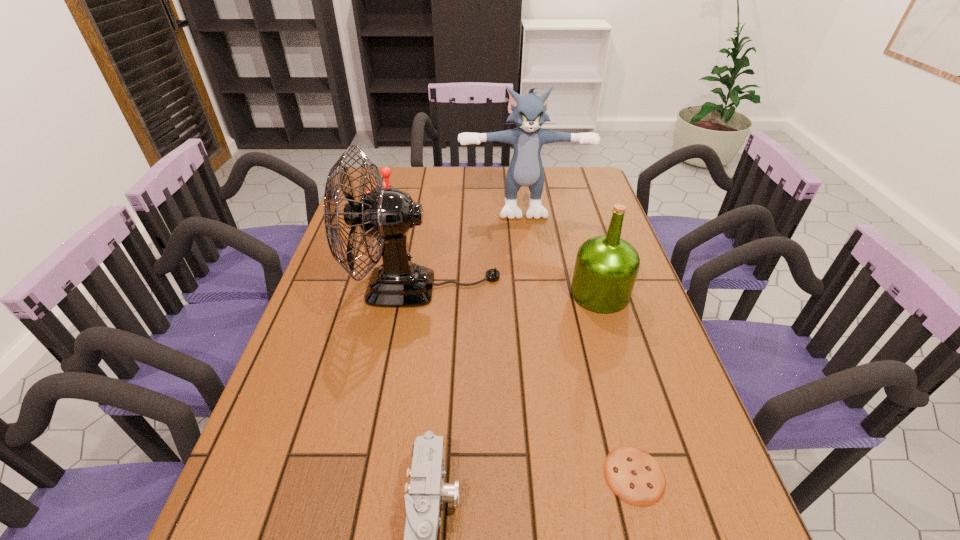
In the image, there is a desktop. Identify the location of free region at the left edge. (319, 357).

In the image, there is a desktop. In order to click on free space at the right edge in this screenshot , I will do `click(597, 333)`.

Find the location of `free spot between the fourth shortest object and the fan`. free spot between the fourth shortest object and the fan is located at coordinates (512, 291).

I want to click on free area in between the olive oil and the shortest object, so click(617, 384).

I want to click on free spot between the fourth tallest object and the shortest object, so click(x=511, y=342).

The image size is (960, 540). Find the location of `unoccupied area between the cookie and the third tallest object`. unoccupied area between the cookie and the third tallest object is located at coordinates (617, 384).

The height and width of the screenshot is (540, 960). I want to click on free area in between the fan and the cat, so click(x=473, y=245).

Locate an element on the screen. The image size is (960, 540). free space between the joystick and the cat is located at coordinates (455, 206).

Locate which object is the fourth closest to the cat. Please provide its 2D coordinates. Your answer should be formatted as a tuple, i.e. [(x, y)], where the tuple contains the x and y coordinates of a point satisfying the conditions above.

[(632, 474)]

What are the coordinates of `object that ranks as the closest to the fan` in the screenshot? It's located at (385, 171).